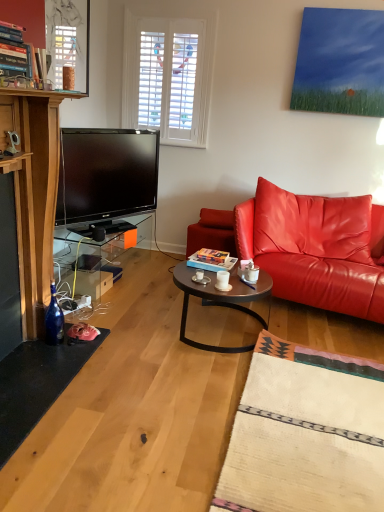
Question: Is transparent glass table at lower left not inside metallic round table at center?

Choices:
 (A) no
 (B) yes

Answer: (B)

Question: Considering the relative sizes of transparent glass table at lower left and metallic round table at center in the image provided, is transparent glass table at lower left shorter than metallic round table at center?

Choices:
 (A) yes
 (B) no

Answer: (B)

Question: Are transparent glass table at lower left and metallic round table at center located far from each other?

Choices:
 (A) yes
 (B) no

Answer: (A)

Question: Considering the relative sizes of transparent glass table at lower left and metallic round table at center in the image provided, is transparent glass table at lower left taller than metallic round table at center?

Choices:
 (A) yes
 (B) no

Answer: (A)

Question: Is transparent glass table at lower left further to the viewer compared to metallic round table at center?

Choices:
 (A) yes
 (B) no

Answer: (A)

Question: Is the depth of transparent glass table at lower left less than that of metallic round table at center?

Choices:
 (A) no
 (B) yes

Answer: (A)

Question: From a real-world perspective, is shiny leather couch at right physically below white ceramic mug at center?

Choices:
 (A) no
 (B) yes

Answer: (A)

Question: Is shiny leather couch at right completely or partially outside of white ceramic mug at center?

Choices:
 (A) no
 (B) yes

Answer: (B)

Question: From a real-world perspective, is shiny leather couch at right physically above white ceramic mug at center?

Choices:
 (A) no
 (B) yes

Answer: (B)

Question: Are shiny leather couch at right and white ceramic mug at center far apart?

Choices:
 (A) yes
 (B) no

Answer: (B)

Question: Is shiny leather couch at right bigger than white ceramic mug at center?

Choices:
 (A) no
 (B) yes

Answer: (B)

Question: Is white ceramic mug at center located within shiny leather couch at right?

Choices:
 (A) no
 (B) yes

Answer: (A)

Question: Is white ceramic mug at center thinner than transparent glass table at lower left?

Choices:
 (A) yes
 (B) no

Answer: (A)